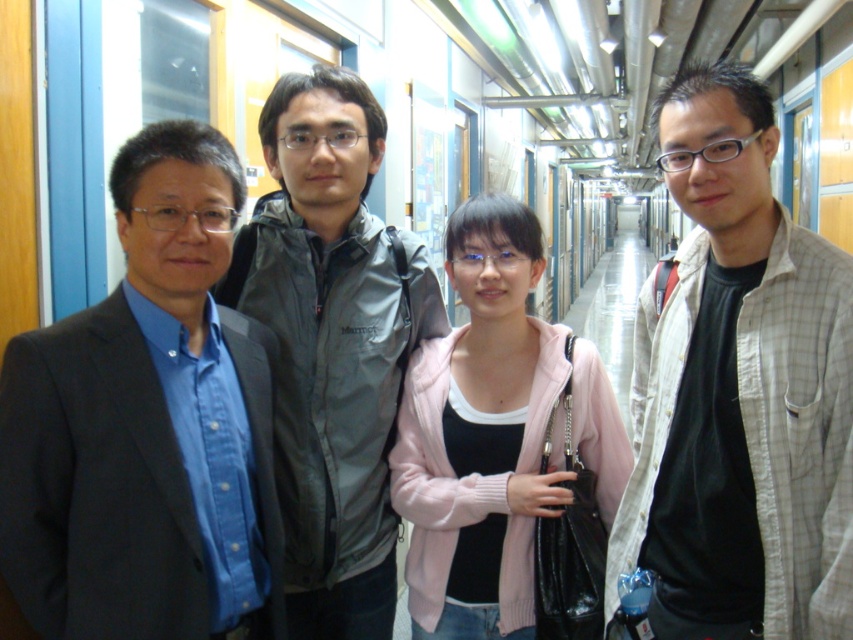
You are standing in the corridor and need to locate the matte black suit at left. According to the coordinates provided, where exactly should you look?

The matte black suit at left is located at coordinates point (146, 426).

You are navigating a corridor and need to reach a door located at point (492, 394). There is an obstacle at point (184, 234). Can you walk directly towards the door without going around the obstacle?

Point (184, 234) is in front of point (492, 394), so you would encounter the obstacle first and cannot walk directly to the door without going around it.